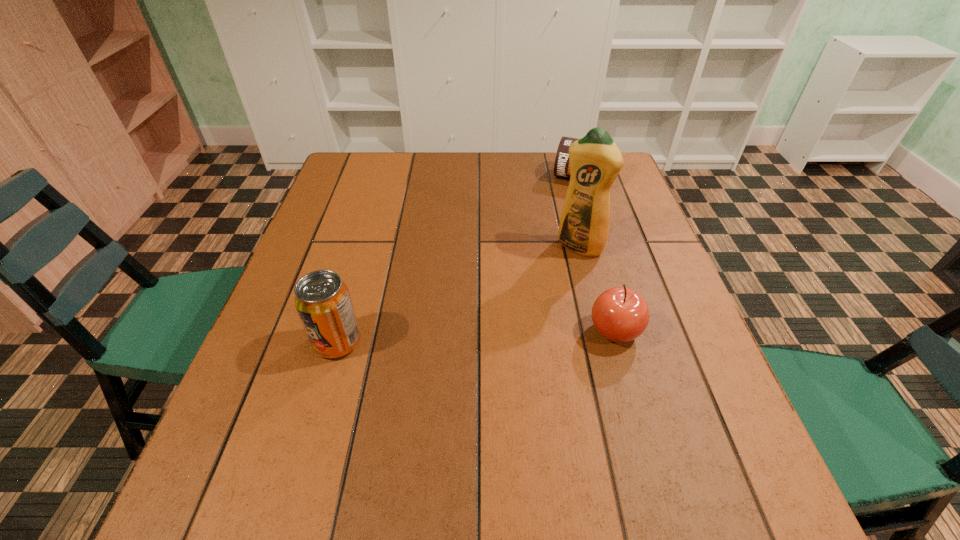
Where is `the third shortest object`? the third shortest object is located at coordinates coord(322,300).

Locate an element on the screen. The height and width of the screenshot is (540, 960). soda can is located at coordinates (322, 300).

The image size is (960, 540). I want to click on apple, so click(619, 314).

What are the coordinates of `can` in the screenshot? It's located at (561, 166).

Image resolution: width=960 pixels, height=540 pixels. I want to click on the tallest object, so click(x=595, y=161).

This screenshot has height=540, width=960. I want to click on detergent, so click(595, 161).

Identify the location of vacant area located on the front of the second tallest object. (319, 408).

You are a GUI agent. You are given a task and a screenshot of the screen. Output one action in this format:
    pyautogui.click(x=<x>, y=<y>)
    Task: Click on the vacant space located 0.110m on the right of the apple
    The image size is (960, 540).
    Given the screenshot: What is the action you would take?
    pyautogui.click(x=694, y=330)

This screenshot has width=960, height=540. I want to click on vacant space located 0.160m on the front label of the farthest object, so click(562, 222).

This screenshot has height=540, width=960. Find the location of `free spot located 0.250m on the front label of the farthest object`. free spot located 0.250m on the front label of the farthest object is located at coordinates (554, 242).